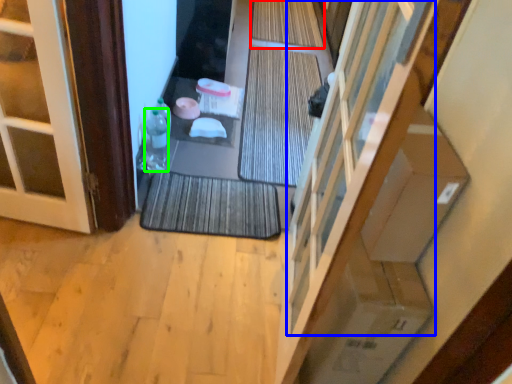
Question: Which object is positioned farthest from bath mat (highlighted by a red box)? Select from window (highlighted by a blue box) and bottle (highlighted by a green box).

Choices:
 (A) window
 (B) bottle

Answer: (A)